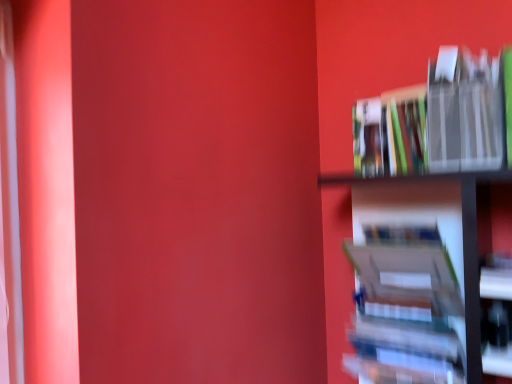
Question: Is hardcover book at upper right, the 2th book when ordered from bottom to top, inside or outside of metallic silver book at right, placed as the third book when sorted from bottom to top?

Choices:
 (A) inside
 (B) outside

Answer: (B)

Question: In terms of size, does hardcover book at upper right, the 2th book when ordered from bottom to top, appear bigger or smaller than metallic silver book at right, placed as the third book when sorted from bottom to top?

Choices:
 (A) small
 (B) big

Answer: (A)

Question: Estimate the real-world distances between objects in this image. Which object is closer to the hardcover book at upper right, placed as the 2th book when sorted from top to bottom?

Choices:
 (A) hardcover book at right, which appears as the 1th book when ordered from the bottom
 (B) metallic silver book at right, placed as the third book when sorted from bottom to top

Answer: (B)

Question: Which is nearer to the hardcover book at right, the 3th book from the top?

Choices:
 (A) hardcover book at upper right, placed as the 2th book when sorted from top to bottom
 (B) metallic silver book at right, placed as the third book when sorted from bottom to top

Answer: (B)